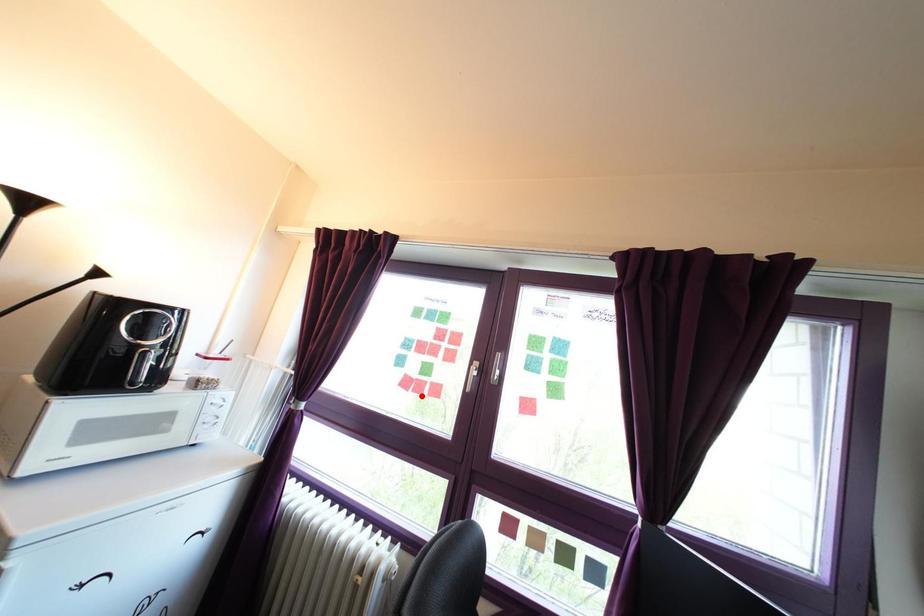
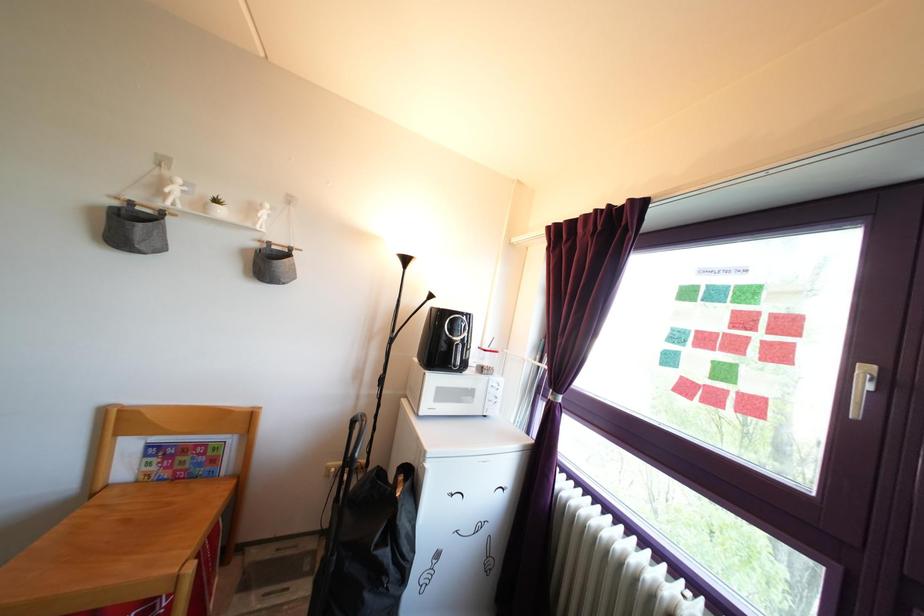
Locate, in the second image, the point that corresponds to the highlighted location in the first image.

(715, 407)